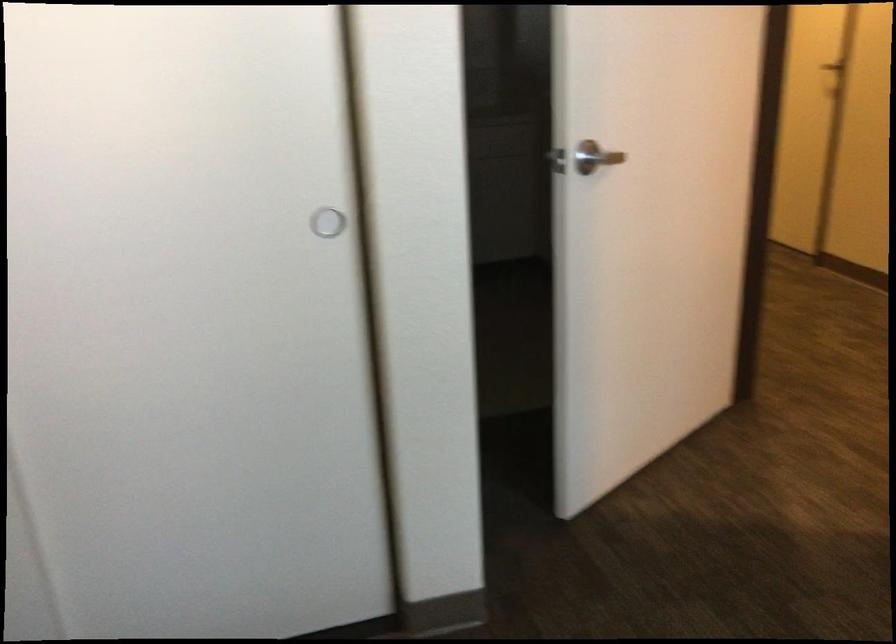
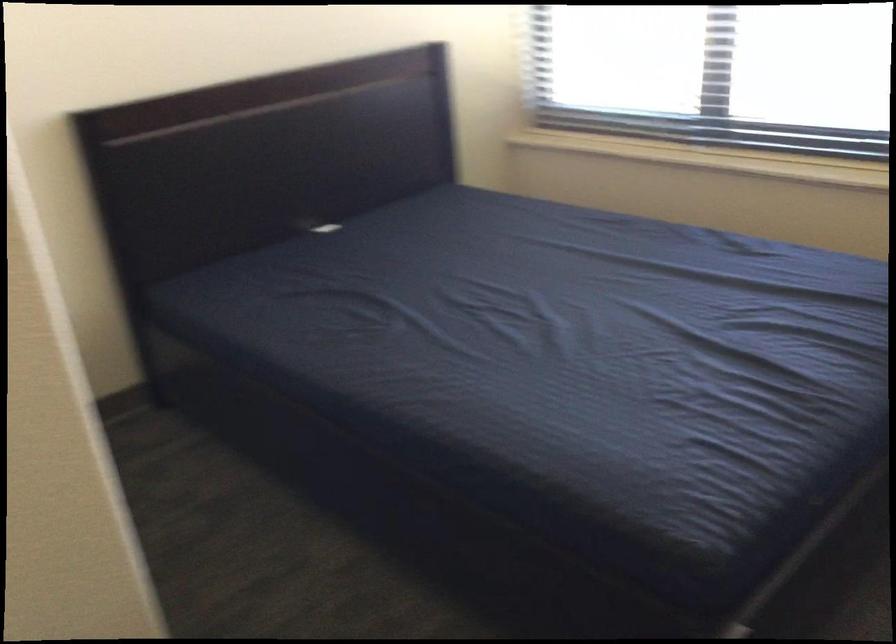
First-person continuous shooting, in which direction is the camera rotating?

The rotation direction of the camera is right-down.